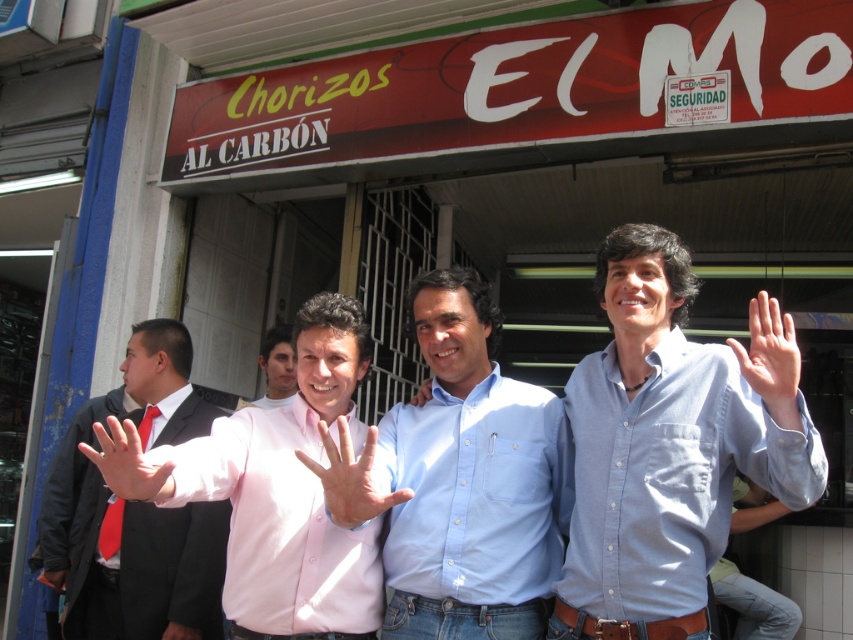
Question: Is pink shirt at left smaller than pink fabric hand at center?

Choices:
 (A) yes
 (B) no

Answer: (B)

Question: Which point appears closest to the camera in this image?

Choices:
 (A) (270, 355)
 (B) (354, 320)
 (C) (328, 442)
 (D) (416, 403)

Answer: (C)

Question: Does pink shirt at left come in front of smooth black hand at center?

Choices:
 (A) no
 (B) yes

Answer: (A)

Question: Which object appears farthest from the camera in this image?

Choices:
 (A) pink shirt at left
 (B) light blue button-down shirt at center
 (C) smooth skin hand at center

Answer: (A)

Question: Which object appears closest to the camera in this image?

Choices:
 (A) pink matte shirt at center
 (B) pink smooth skin at center
 (C) pink shirt at left
 (D) blue cotton shirt at center

Answer: (A)

Question: Does pink shirt at left have a greater width compared to light skin smooth hand at center right?

Choices:
 (A) yes
 (B) no

Answer: (A)